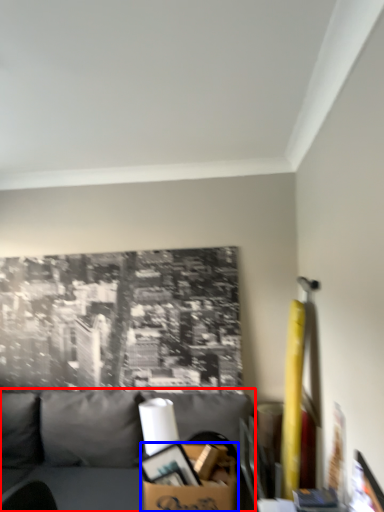
Question: Which point is further to the camera, studio couch (highlighted by a red box) or cardboard box (highlighted by a blue box)?

Choices:
 (A) studio couch
 (B) cardboard box

Answer: (B)